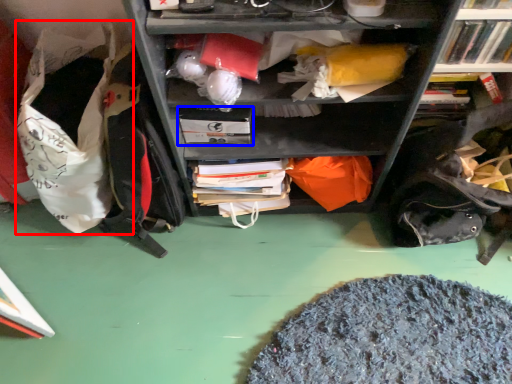
Question: Among these objects, which one is nearest to the camera, bean bag chair (highlighted by a red box) or paperback book (highlighted by a blue box)?

Choices:
 (A) bean bag chair
 (B) paperback book

Answer: (A)